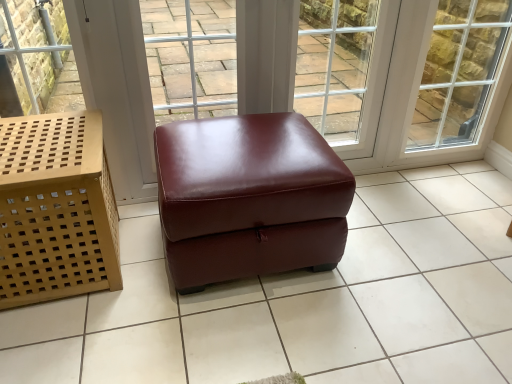
Find the location of a particular element. This screenshot has width=512, height=384. vacant space to the right of light brown woven basket at left is located at coordinates (159, 288).